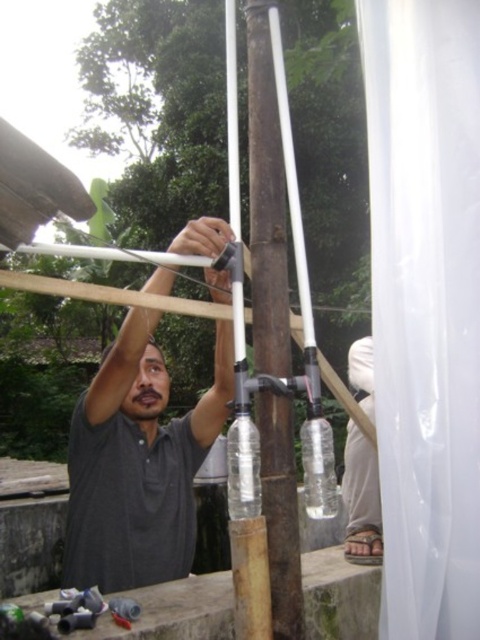
Does white sheer curtain at right come in front of dark gray shirt at center?

Yes, it is.

Between white sheer curtain at right and dark gray shirt at center, which one appears on the left side from the viewer's perspective?

Positioned to the left is dark gray shirt at center.

Locate an element on the screen. white sheer curtain at right is located at coordinates (425, 307).

This screenshot has width=480, height=640. I want to click on white sheer curtain at right, so click(425, 307).

Is white sheer curtain at right positioned before dark gray skin at upper center?

That is True.

Is point (436, 595) farther from viewer compared to point (115, 340)?

No, it is in front of (115, 340).

This screenshot has width=480, height=640. I want to click on white sheer curtain at right, so click(x=425, y=307).

Which is more to the right, white sheer curtain at right or white plastic pole at center?

Positioned to the right is white sheer curtain at right.

Does white sheer curtain at right have a smaller size compared to white plastic pole at center?

No, white sheer curtain at right is not smaller than white plastic pole at center.

Image resolution: width=480 pixels, height=640 pixels. What do you see at coordinates (425, 307) in the screenshot? I see `white sheer curtain at right` at bounding box center [425, 307].

Where is `white sheer curtain at right`? This screenshot has width=480, height=640. white sheer curtain at right is located at coordinates (425, 307).